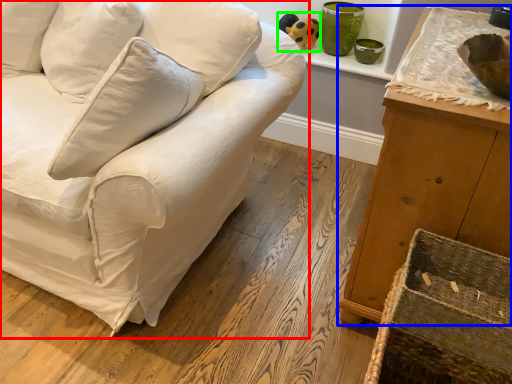
Question: Which object is the closest to the studio couch (highlighted by a red box)? Choose among these: furniture (highlighted by a blue box) or toy (highlighted by a green box).

Choices:
 (A) furniture
 (B) toy

Answer: (A)